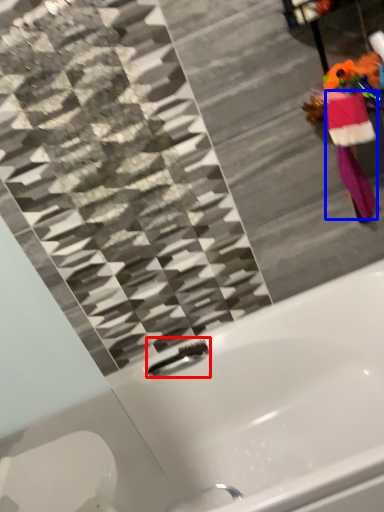
Question: Which point is further to the camera, faucet (highlighted by a red box) or robe (highlighted by a blue box)?

Choices:
 (A) faucet
 (B) robe

Answer: (A)